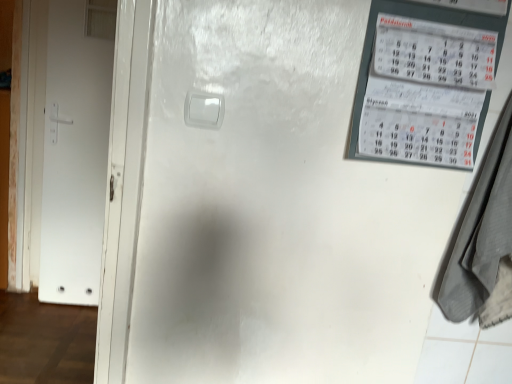
Question: Considering the positions of white matte door at left and gray fabric laundry at right in the image, is white matte door at left taller or shorter than gray fabric laundry at right?

Choices:
 (A) tall
 (B) short

Answer: (A)

Question: Is point (95, 137) positioned closer to the camera than point (477, 241)?

Choices:
 (A) farther
 (B) closer

Answer: (A)

Question: From a real-world perspective, is white matte door at left physically located above or below gray fabric laundry at right?

Choices:
 (A) below
 (B) above

Answer: (A)

Question: Considering the positions of gray fabric laundry at right and white matte door at left in the image, is gray fabric laundry at right taller or shorter than white matte door at left?

Choices:
 (A) tall
 (B) short

Answer: (B)

Question: From the image's perspective, is gray fabric laundry at right above or below white matte door at left?

Choices:
 (A) above
 (B) below

Answer: (B)

Question: Is gray fabric laundry at right wider or thinner than white matte door at left?

Choices:
 (A) thin
 (B) wide

Answer: (B)

Question: From a real-world perspective, is gray fabric laundry at right above or below white matte door at left?

Choices:
 (A) above
 (B) below

Answer: (A)